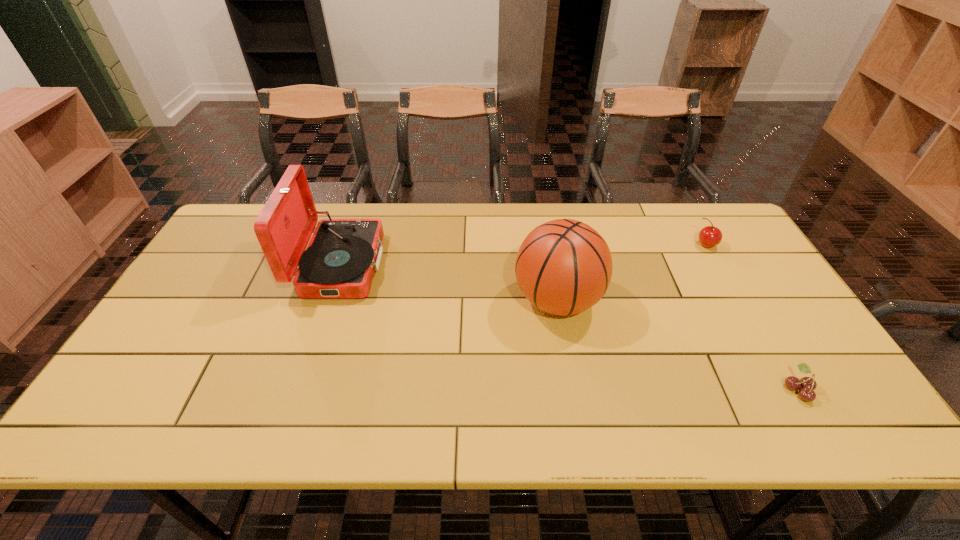
At what (x,y) coordinates should I click in order to perform the action: click on phonograph_record. Please return your answer as a coordinate pair (x, y). The image size is (960, 540). Looking at the image, I should click on (343, 254).

The image size is (960, 540). In order to click on basketball in this screenshot , I will do `click(563, 267)`.

I want to click on the second shortest object, so click(x=710, y=236).

What are the coordinates of `the farther cherry` in the screenshot? It's located at (710, 236).

Identify the location of the nearest object. The width and height of the screenshot is (960, 540). (808, 384).

Where is `the shorter cherry`? the shorter cherry is located at coordinates (808, 384).

You are a GUI agent. You are given a task and a screenshot of the screen. Output one action in this format:
    pyautogui.click(x=<x>, y=<y>)
    Task: Click on the free region located on the front-facing side of the phonograph_record
    The width and height of the screenshot is (960, 540).
    Given the screenshot: What is the action you would take?
    pyautogui.click(x=398, y=265)

Identify the location of vacant space located on the left of the second object from left to right. The image size is (960, 540). (419, 301).

In order to click on vacant area located 0.060m on the right of the taller cherry in this screenshot , I will do `click(735, 245)`.

Locate an element on the screen. The width and height of the screenshot is (960, 540). vacant space located on the leaves of the nearer cherry is located at coordinates (693, 389).